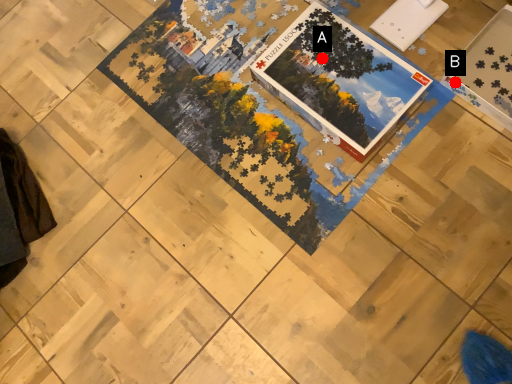
Question: Two points are circled on the image, labeled by A and B beside each circle. Which point is farther to the camera?

Choices:
 (A) A is further
 (B) B is further

Answer: (A)